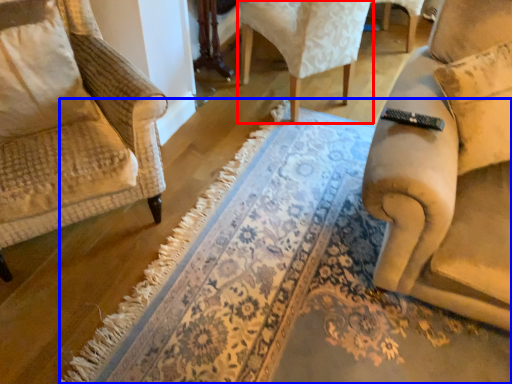
Question: Which of the following is the closest to the observer, chair (highlighted by a red box) or doormat (highlighted by a blue box)?

Choices:
 (A) chair
 (B) doormat

Answer: (B)